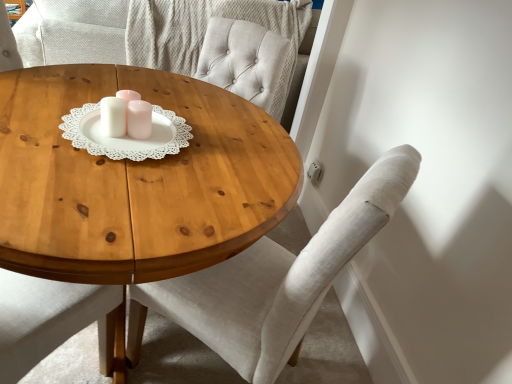
Question: Is light gray fabric chair at center facing towards white glossy candle holder at center?

Choices:
 (A) yes
 (B) no

Answer: (A)

Question: Can you confirm if light gray fabric chair at center is taller than white glossy candle holder at center?

Choices:
 (A) yes
 (B) no

Answer: (A)

Question: From the image's perspective, is light gray fabric chair at center on white glossy candle holder at center?

Choices:
 (A) yes
 (B) no

Answer: (B)

Question: Is light gray fabric chair at center smaller than white glossy candle holder at center?

Choices:
 (A) yes
 (B) no

Answer: (B)

Question: From the image's perspective, is light gray fabric chair at center below white glossy candle holder at center?

Choices:
 (A) yes
 (B) no

Answer: (A)

Question: Is point (320, 253) positioned closer to the camera than point (126, 129)?

Choices:
 (A) farther
 (B) closer

Answer: (B)

Question: Considering the positions of light gray fabric chair at center and white glossy candle holder at center in the image, is light gray fabric chair at center wider or thinner than white glossy candle holder at center?

Choices:
 (A) thin
 (B) wide

Answer: (B)

Question: From a real-world perspective, is light gray fabric chair at center above or below white glossy candle holder at center?

Choices:
 (A) above
 (B) below

Answer: (B)

Question: Is light gray fabric chair at center in front of or behind white glossy candle holder at center in the image?

Choices:
 (A) front
 (B) behind

Answer: (A)

Question: In terms of width, does wooden coffee table at center look wider or thinner when compared to white glossy candle holder at center?

Choices:
 (A) wide
 (B) thin

Answer: (A)

Question: Would you say wooden coffee table at center is inside or outside white glossy candle holder at center?

Choices:
 (A) outside
 (B) inside

Answer: (A)

Question: From the image's perspective, relative to white glossy candle holder at center, is wooden coffee table at center above or below?

Choices:
 (A) above
 (B) below

Answer: (B)

Question: Based on their sizes in the image, would you say wooden coffee table at center is bigger or smaller than white glossy candle holder at center?

Choices:
 (A) big
 (B) small

Answer: (A)

Question: Considering the positions of white glossy candle holder at center and wooden coffee table at center in the image, is white glossy candle holder at center wider or thinner than wooden coffee table at center?

Choices:
 (A) thin
 (B) wide

Answer: (A)

Question: Looking at the image, does white glossy candle holder at center seem bigger or smaller compared to wooden coffee table at center?

Choices:
 (A) small
 (B) big

Answer: (A)